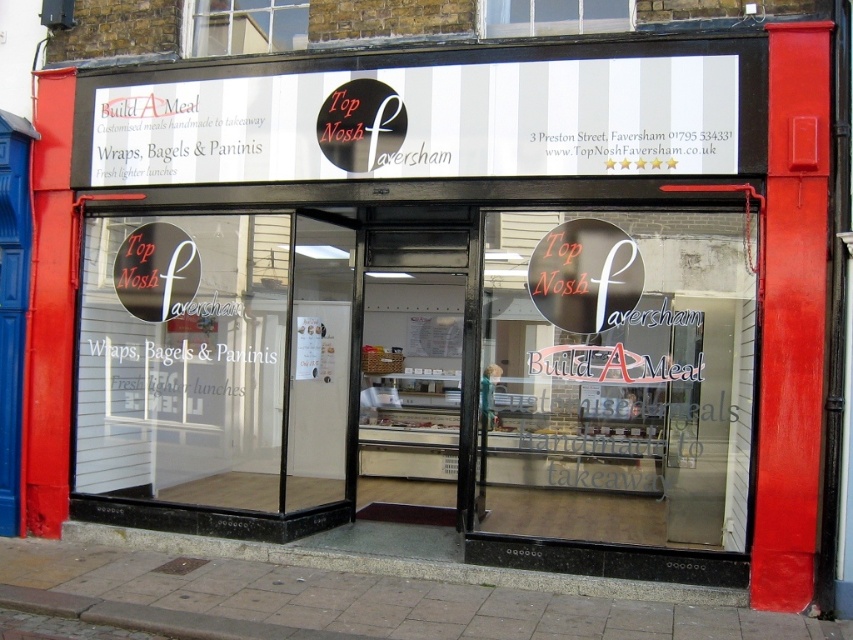
Question: Where is transparent glass door at center located in relation to clear glass window at upper center in the image?

Choices:
 (A) left
 (B) right

Answer: (B)

Question: Is transparent glass door at center behind white striped sign at upper center?

Choices:
 (A) yes
 (B) no

Answer: (B)

Question: Is transparent glass door at center above white striped sign at upper center?

Choices:
 (A) no
 (B) yes

Answer: (A)

Question: Which point is farther to the camera?

Choices:
 (A) white glass window at upper center
 (B) transparent glass door at center
 (C) white striped sign at upper center

Answer: (A)

Question: Estimate the real-world distances between objects in this image. Which object is closer to the clear glass window at upper center?

Choices:
 (A) white glass window at upper center
 (B) white striped sign at upper center
 (C) transparent glass door at center

Answer: (B)

Question: Which object is positioned farthest from the white striped sign at upper center?

Choices:
 (A) white glass window at upper center
 (B) clear glass window at upper center
 (C) transparent glass door at center

Answer: (C)